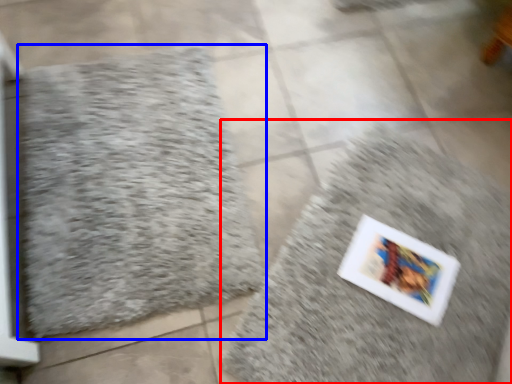
Question: Which object appears closest to the camera in this image, bath mat (highlighted by a red box) or bath mat (highlighted by a blue box)?

Choices:
 (A) bath mat
 (B) bath mat

Answer: (A)